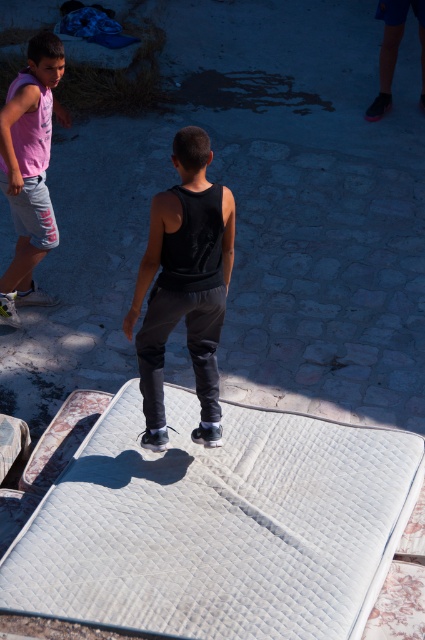
Who is positioned more to the right, white quilted mattress at center or matte pink tank top at left?

Positioned to the right is white quilted mattress at center.

Does white quilted mattress at center have a greater height compared to matte pink tank top at left?

In fact, white quilted mattress at center may be shorter than matte pink tank top at left.

The image size is (425, 640). In order to click on white quilted mattress at center in this screenshot , I will do `click(218, 525)`.

Where is `white quilted mattress at center`? white quilted mattress at center is located at coordinates (218, 525).

Does point (150, 244) lie in front of point (28, 96)?

Yes, point (150, 244) is closer to viewer.

Is point (158, 337) farther from viewer compared to point (39, 86)?

No, (158, 337) is in front of (39, 86).

From the picture: Who is more forward, (220, 282) or (56, 100)?

Point (220, 282)

This screenshot has width=425, height=640. What are the coordinates of `black matte tank top at center` in the screenshot? It's located at (184, 285).

Is white quilted mattress at center above black matte tank top at center?

Incorrect, white quilted mattress at center is not positioned above black matte tank top at center.

Who is more distant from viewer, (116, 508) or (158, 388)?

Point (158, 388)

The image size is (425, 640). I want to click on white quilted mattress at center, so click(x=218, y=525).